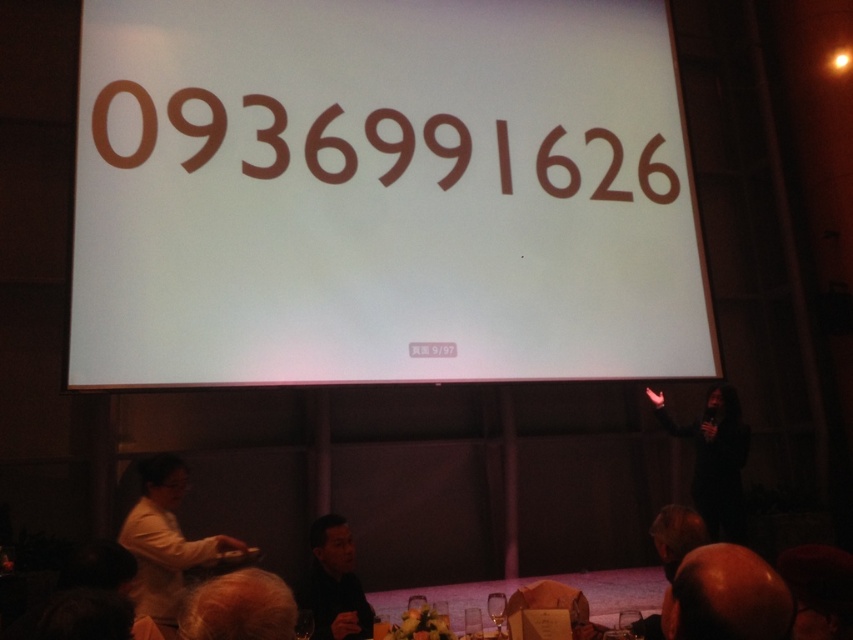
You are standing in the conference room and want to take a photo of the two points mentioned. Which point, point (757, 577) or point (141, 540), will appear larger in your photo?

Point (757, 577) is closer to the camera than point (141, 540), so it will appear larger in the photo.

You are standing at the back of the room and want to walk to the front. Which object, the wooden table at lower center or the light brown hair at lower left, would you encounter first as you move forward?

The wooden table at lower center is closer to you than the light brown hair at lower left, so you would encounter the wooden table at lower center first as you move forward.